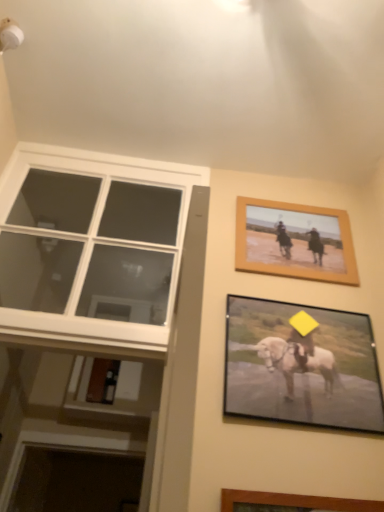
Describe the element at coordinates (295, 241) in the screenshot. This screenshot has width=384, height=512. I see `wooden framed picture at upper right, the second picture frame from the front` at that location.

I want to click on matte black picture frame at lower right, the first picture frame positioned from the front, so click(301, 366).

Locate an element on the screen. wooden framed picture at upper right, the second picture frame from the front is located at coordinates (295, 241).

Is matte black picture frame at lower right, which is the 2th picture frame from back to front, positioned with its back to wooden framed picture at upper right, the first picture frame viewed from the top?

matte black picture frame at lower right, which is the 2th picture frame from back to front, is not turned away from wooden framed picture at upper right, the first picture frame viewed from the top.

Looking at this image, from a real-world perspective, which object rests below the other?

matte black picture frame at lower right, the first picture frame positioned from the front.

You are a GUI agent. You are given a task and a screenshot of the screen. Output one action in this format:
    pyautogui.click(x=<x>, y=<y>)
    Task: Click on the picture frame that is on the left side of wooden framed picture at upper right, placed as the 2th picture frame when sorted from bottom to top
    The width and height of the screenshot is (384, 512).
    Given the screenshot: What is the action you would take?
    pyautogui.click(x=301, y=366)

Is point (347, 326) more distant than point (297, 247)?

No, it is in front of (297, 247).

From a real-world perspective, is wooden framed picture at upper right, placed as the 2th picture frame when sorted from bottom to top, above or below white glass window at left?

wooden framed picture at upper right, placed as the 2th picture frame when sorted from bottom to top, is situated higher than white glass window at left in the real world.

Is wooden framed picture at upper right, the first picture frame viewed from the top, smaller than white glass window at left?

Yes.

From the image's perspective, which one is positioned higher, wooden framed picture at upper right, the second picture frame from the front, or white glass window at left?

white glass window at left is shown above in the image.

Does white glass window at left appear on the right side of matte black picture frame at lower right, which is the 2th picture frame from back to front?

No, white glass window at left is not to the right of matte black picture frame at lower right, which is the 2th picture frame from back to front.

Can you confirm if white glass window at left is shorter than matte black picture frame at lower right, the second picture frame in the top-to-bottom sequence?

No, white glass window at left is not shorter than matte black picture frame at lower right, the second picture frame in the top-to-bottom sequence.

Between white glass window at left and matte black picture frame at lower right, the first picture frame positioned from the front, which one has larger width?

white glass window at left.

Considering the relative sizes of wooden framed picture at upper right, the second picture frame from the front, and matte black picture frame at lower right, arranged as the 1th picture frame when ordered from the bottom, in the image provided, is wooden framed picture at upper right, the second picture frame from the front, smaller than matte black picture frame at lower right, arranged as the 1th picture frame when ordered from the bottom,?

Yes, wooden framed picture at upper right, the second picture frame from the front, is smaller than matte black picture frame at lower right, arranged as the 1th picture frame when ordered from the bottom.

Considering the sizes of objects wooden framed picture at upper right, placed as the 2th picture frame when sorted from bottom to top, and matte black picture frame at lower right, arranged as the 1th picture frame when ordered from the bottom, in the image provided, who is taller, wooden framed picture at upper right, placed as the 2th picture frame when sorted from bottom to top, or matte black picture frame at lower right, arranged as the 1th picture frame when ordered from the bottom,?

matte black picture frame at lower right, arranged as the 1th picture frame when ordered from the bottom, is taller.

From a real-world perspective, which is physically above, wooden framed picture at upper right, the second picture frame from the front, or matte black picture frame at lower right, which is the 2th picture frame from back to front?

wooden framed picture at upper right, the second picture frame from the front.

From the image's perspective, is wooden framed picture at upper right, the first picture frame viewed from the top, over matte black picture frame at lower right, the first picture frame positioned from the front?

Correct, wooden framed picture at upper right, the first picture frame viewed from the top, appears higher than matte black picture frame at lower right, the first picture frame positioned from the front, in the image.

From the image's perspective, between white glass window at left and wooden framed picture at upper right, placed as the 2th picture frame when sorted from bottom to top, which one is located above?

white glass window at left, from the image's perspective.

The height and width of the screenshot is (512, 384). In order to click on window in front of the wooden framed picture at upper right, placed as the 2th picture frame when sorted from bottom to top in this screenshot , I will do `click(98, 233)`.

Is white glass window at left in front of or behind wooden framed picture at upper right, placed as the 2th picture frame when sorted from bottom to top, in the image?

white glass window at left is in front of wooden framed picture at upper right, placed as the 2th picture frame when sorted from bottom to top.

Can you confirm if white glass window at left is thinner than wooden framed picture at upper right, marked as the first picture frame in a back-to-front arrangement?

In fact, white glass window at left might be wider than wooden framed picture at upper right, marked as the first picture frame in a back-to-front arrangement.

From a real-world perspective, between matte black picture frame at lower right, which is the 2th picture frame from back to front, and white glass window at left, who is vertically higher?

From a 3D spatial view, white glass window at left is above.

From the picture: Is the surface of matte black picture frame at lower right, the first picture frame positioned from the front, in direct contact with white glass window at left?

There is a gap between matte black picture frame at lower right, the first picture frame positioned from the front, and white glass window at left.

Between matte black picture frame at lower right, the first picture frame positioned from the front, and white glass window at left, which one has smaller size?

matte black picture frame at lower right, the first picture frame positioned from the front, is smaller.

Find the location of `window above the matte black picture frame at lower right, which is the 2th picture frame from back to front (from the image's perspective)`. window above the matte black picture frame at lower right, which is the 2th picture frame from back to front (from the image's perspective) is located at coordinates (98, 233).

Image resolution: width=384 pixels, height=512 pixels. I want to click on picture frame above the matte black picture frame at lower right, the second picture frame in the top-to-bottom sequence (from a real-world perspective), so click(x=295, y=241).

Find the location of a particular element. The height and width of the screenshot is (512, 384). window in front of the wooden framed picture at upper right, marked as the first picture frame in a back-to-front arrangement is located at coordinates (98, 233).

From the image, which object appears to be nearer to white glass window at left, wooden framed picture at upper right, placed as the 2th picture frame when sorted from bottom to top, or matte black picture frame at lower right, the second picture frame in the top-to-bottom sequence?

Among the two, wooden framed picture at upper right, placed as the 2th picture frame when sorted from bottom to top, is located nearer to white glass window at left.

Considering their positions, is matte black picture frame at lower right, the first picture frame positioned from the front, positioned further to white glass window at left than wooden framed picture at upper right, the second picture frame from the front?

Based on the image, matte black picture frame at lower right, the first picture frame positioned from the front, appears to be further to white glass window at left.

When comparing their distances from wooden framed picture at upper right, placed as the 2th picture frame when sorted from bottom to top, does white glass window at left or matte black picture frame at lower right, the first picture frame positioned from the front, seem closer?

matte black picture frame at lower right, the first picture frame positioned from the front, lies closer to wooden framed picture at upper right, placed as the 2th picture frame when sorted from bottom to top, than the other object.

When comparing their distances from wooden framed picture at upper right, the second picture frame from the front, does matte black picture frame at lower right, which is the 2th picture frame from back to front, or white glass window at left seem closer?

matte black picture frame at lower right, which is the 2th picture frame from back to front, is positioned closer to the anchor wooden framed picture at upper right, the second picture frame from the front.

Based on their spatial positions, is wooden framed picture at upper right, the first picture frame viewed from the top, or white glass window at left closer to matte black picture frame at lower right, the second picture frame in the top-to-bottom sequence?

wooden framed picture at upper right, the first picture frame viewed from the top, is closer to matte black picture frame at lower right, the second picture frame in the top-to-bottom sequence.

When comparing their distances from matte black picture frame at lower right, arranged as the 1th picture frame when ordered from the bottom, does white glass window at left or wooden framed picture at upper right, placed as the 2th picture frame when sorted from bottom to top, seem closer?

wooden framed picture at upper right, placed as the 2th picture frame when sorted from bottom to top, is positioned closer to the anchor matte black picture frame at lower right, arranged as the 1th picture frame when ordered from the bottom.

Where is `picture frame located between white glass window at left and wooden framed picture at upper right, the second picture frame from the front, in the left-right direction`? picture frame located between white glass window at left and wooden framed picture at upper right, the second picture frame from the front, in the left-right direction is located at coordinates (301, 366).